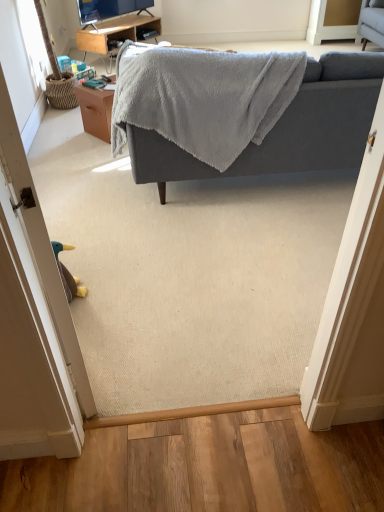
Question: Considering the relative sizes of woodendesk at upper center and brown fabric door at lower left in the image provided, is woodendesk at upper center taller than brown fabric door at lower left?

Choices:
 (A) no
 (B) yes

Answer: (A)

Question: Is woodendesk at upper center shorter than brown fabric door at lower left?

Choices:
 (A) no
 (B) yes

Answer: (B)

Question: Can you confirm if woodendesk at upper center is positioned to the right of brown fabric door at lower left?

Choices:
 (A) yes
 (B) no

Answer: (B)

Question: From a real-world perspective, is woodendesk at upper center physically below brown fabric door at lower left?

Choices:
 (A) yes
 (B) no

Answer: (A)

Question: From the image's perspective, does woodendesk at upper center appear higher than brown fabric door at lower left?

Choices:
 (A) yes
 (B) no

Answer: (A)

Question: In terms of size, does brown fabric door at lower left appear bigger or smaller than woodendesk at upper center?

Choices:
 (A) big
 (B) small

Answer: (B)

Question: Is brown fabric door at lower left in front of or behind woodendesk at upper center in the image?

Choices:
 (A) front
 (B) behind

Answer: (A)

Question: Would you say brown fabric door at lower left is to the left or to the right of woodendesk at upper center in the picture?

Choices:
 (A) right
 (B) left

Answer: (A)

Question: Is point (57, 450) closer or farther from the camera than point (135, 32)?

Choices:
 (A) farther
 (B) closer

Answer: (B)

Question: From the image's perspective, is brown wood table at center located above or below gray soft fabric couch at upper center?

Choices:
 (A) below
 (B) above

Answer: (B)

Question: Is brown wood table at center wider or thinner than gray soft fabric couch at upper center?

Choices:
 (A) thin
 (B) wide

Answer: (A)

Question: In the image, is brown wood table at center positioned in front of or behind gray soft fabric couch at upper center?

Choices:
 (A) front
 (B) behind

Answer: (B)

Question: From their relative heights in the image, would you say brown wood table at center is taller or shorter than gray soft fabric couch at upper center?

Choices:
 (A) short
 (B) tall

Answer: (A)

Question: Considering the positions of woodendesk at upper center and gray soft fabric couch at upper center in the image, is woodendesk at upper center wider or thinner than gray soft fabric couch at upper center?

Choices:
 (A) thin
 (B) wide

Answer: (A)

Question: Considering the positions of point (104, 47) and point (127, 131), is point (104, 47) closer or farther from the camera than point (127, 131)?

Choices:
 (A) farther
 (B) closer

Answer: (A)